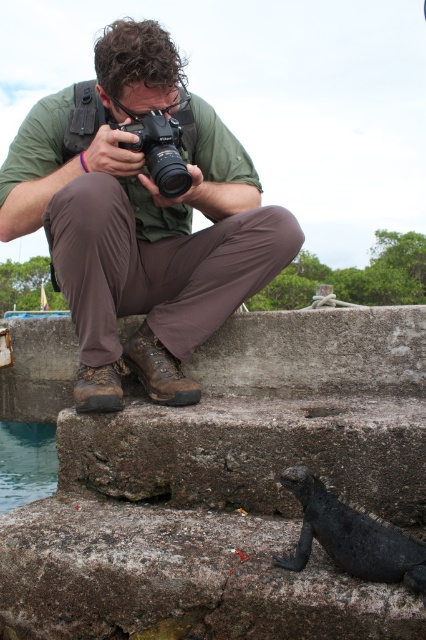
Question: Which point appears farthest from the camera in this image?

Choices:
 (A) (290, 472)
 (B) (203, 244)

Answer: (B)

Question: Is shiny black lizard at lower right positioned in front of black plastic camera at center?

Choices:
 (A) yes
 (B) no

Answer: (A)

Question: Can you confirm if shiny black lizard at lower right is smaller than black plastic camera at center?

Choices:
 (A) yes
 (B) no

Answer: (A)

Question: Which object appears closest to the camera in this image?

Choices:
 (A) shiny black lizard at lower right
 (B) black plastic camera at center
 (C) green matte shirt at center

Answer: (A)

Question: Estimate the real-world distances between objects in this image. Which object is farther from the green matte shirt at center?

Choices:
 (A) shiny black lizard at lower right
 (B) black plastic camera at center

Answer: (A)

Question: Does green matte shirt at center have a lesser width compared to shiny black lizard at lower right?

Choices:
 (A) no
 (B) yes

Answer: (A)